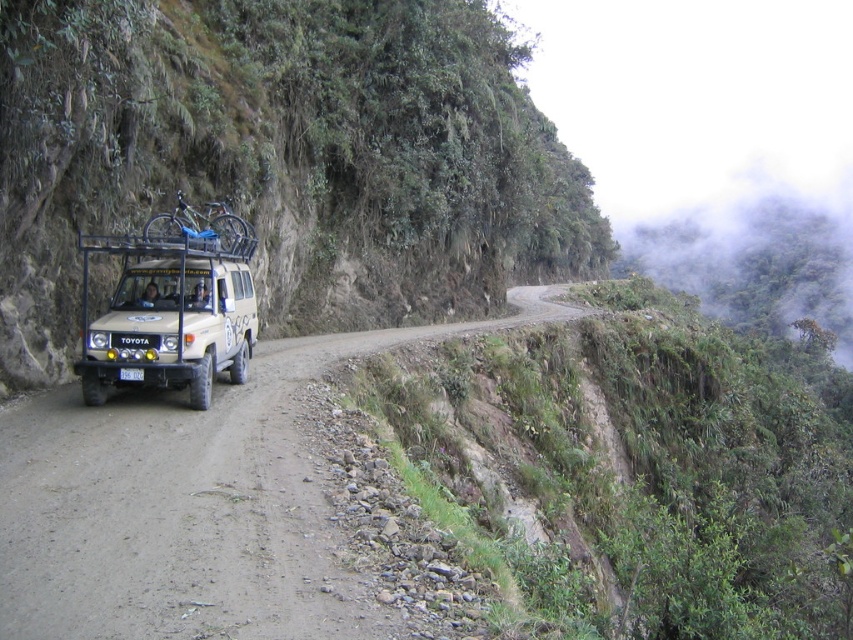
Question: Does green mossy hillside at left appear on the left side of dirt road at center?

Choices:
 (A) yes
 (B) no

Answer: (B)

Question: Which point is closer to the camera taking this photo?

Choices:
 (A) (119, 371)
 (B) (148, 272)
 (C) (219, 438)

Answer: (C)

Question: From the image, what is the correct spatial relationship of dirt road at center in relation to beige matte suv at center-left?

Choices:
 (A) right
 (B) left

Answer: (A)

Question: Among these objects, which one is nearest to the camera?

Choices:
 (A) green mossy hillside at left
 (B) white plastic license plate at center
 (C) dirt road at center
 (D) beige matte suv at center-left

Answer: (C)

Question: Which point is farther from the camera taking this photo?

Choices:
 (A) (141, 380)
 (B) (248, 76)
 (C) (218, 346)

Answer: (B)

Question: Is beige matte suv at center-left to the right of white plastic license plate at center from the viewer's perspective?

Choices:
 (A) no
 (B) yes

Answer: (B)